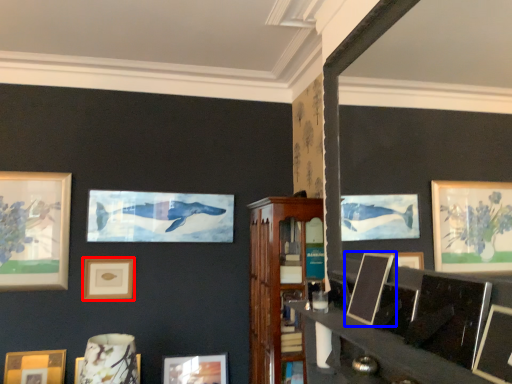
Question: Which point is further to the camera, picture frame (highlighted by a red box) or picture frame (highlighted by a blue box)?

Choices:
 (A) picture frame
 (B) picture frame

Answer: (A)